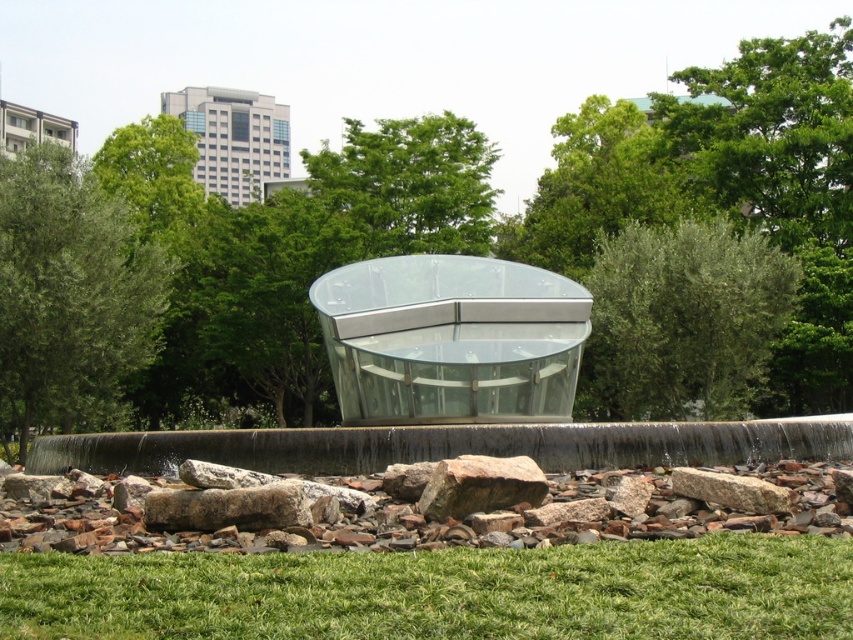
Who is positioned more to the right, green leafy tree at center or green leafy tree at upper center?

Positioned to the right is green leafy tree at center.

Can you confirm if green leafy tree at center is bigger than green leafy tree at upper center?

No.

In order to click on green leafy tree at center in this screenshot , I will do `click(682, 321)`.

Does green grass at lower center have a greater width compared to transparent glass bench at center?

Yes, green grass at lower center is wider than transparent glass bench at center.

Who is lower down, green grass at lower center or transparent glass bench at center?

green grass at lower center is lower down.

Measure the distance between green grass at lower center and camera.

A distance of 12.99 feet exists between green grass at lower center and camera.

I want to click on green grass at lower center, so click(x=444, y=592).

What do you see at coordinates (410, 184) in the screenshot?
I see `green leafy tree at upper center` at bounding box center [410, 184].

Who is taller, green leafy tree at upper center or brown rough rock at lower center?

With more height is green leafy tree at upper center.

Who is more forward, (396, 122) or (474, 481)?

Positioned in front is point (474, 481).

At what (x,y) coordinates should I click in order to perform the action: click on green leafy tree at upper center. Please return your answer as a coordinate pair (x, y). Looking at the image, I should click on (410, 184).